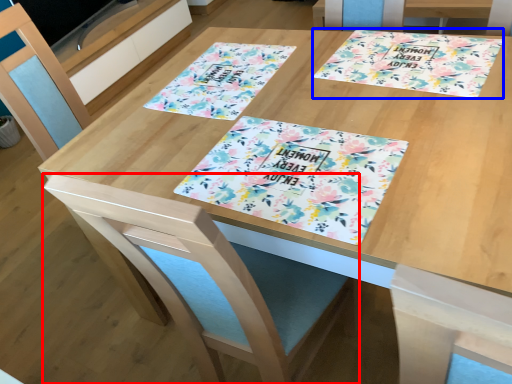
Question: Which point is further to the camera, swivel chair (highlighted by a red box) or tablecloth (highlighted by a blue box)?

Choices:
 (A) swivel chair
 (B) tablecloth

Answer: (B)